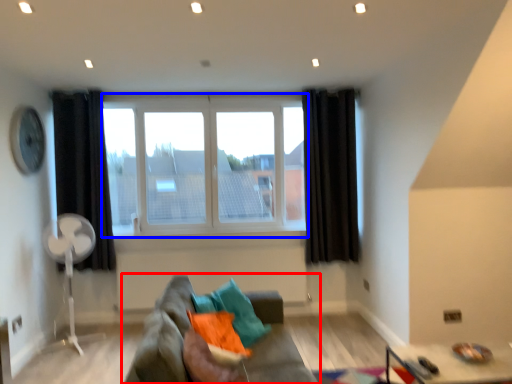
Question: Which object appears closest to the camera in this image, studio couch (highlighted by a red box) or window (highlighted by a blue box)?

Choices:
 (A) studio couch
 (B) window

Answer: (A)